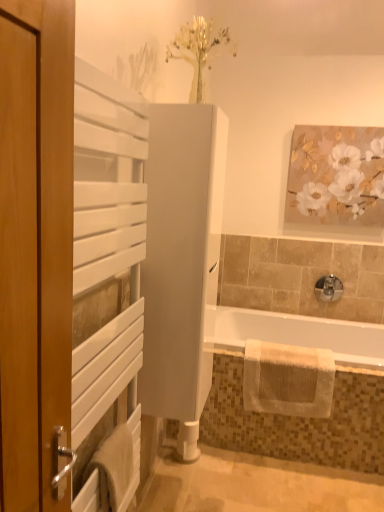
Question: Should I look upward or downward to see satin nickel faucet at lower right?

Choices:
 (A) up
 (B) down

Answer: (B)

Question: Considering the relative sizes of white textured towel at lower right, which appears as the 2th bath towel when viewed from the left, and white glossy bathtub at lower center in the image provided, is white textured towel at lower right, which appears as the 2th bath towel when viewed from the left, smaller than white glossy bathtub at lower center?

Choices:
 (A) yes
 (B) no

Answer: (B)

Question: Considering the relative sizes of white textured towel at lower right, which appears as the 2th bath towel when viewed from the left, and white glossy bathtub at lower center in the image provided, is white textured towel at lower right, which appears as the 2th bath towel when viewed from the left, taller than white glossy bathtub at lower center?

Choices:
 (A) no
 (B) yes

Answer: (B)

Question: Would you say white textured towel at lower right, which appears as the 2th bath towel when viewed from the left, contains white glossy bathtub at lower center?

Choices:
 (A) yes
 (B) no

Answer: (B)

Question: Does white textured towel at lower right, placed as the 2th bath towel when sorted from front to back, have a lesser width compared to white glossy bathtub at lower center?

Choices:
 (A) no
 (B) yes

Answer: (B)

Question: From a real-world perspective, is white textured towel at lower right, placed as the 1th bath towel when sorted from back to front, located higher than white glossy bathtub at lower center?

Choices:
 (A) yes
 (B) no

Answer: (B)

Question: Considering the relative positions of white textured towel at lower right, placed as the 1th bath towel when sorted from back to front, and white glossy bathtub at lower center in the image provided, is white textured towel at lower right, placed as the 1th bath towel when sorted from back to front, in front of white glossy bathtub at lower center?

Choices:
 (A) yes
 (B) no

Answer: (B)

Question: Is white glossy tub at lower right completely or partially inside white textured towel at lower right, placed as the 1th bath towel when sorted from back to front?

Choices:
 (A) yes
 (B) no

Answer: (B)

Question: From the image's perspective, is white textured towel at lower right, placed as the 1th bath towel when sorted from back to front, below white glossy tub at lower right?

Choices:
 (A) no
 (B) yes

Answer: (B)

Question: Does white textured towel at lower right, placed as the 1th bath towel when sorted from right to left, have a lesser width compared to white glossy tub at lower right?

Choices:
 (A) no
 (B) yes

Answer: (B)

Question: Is white textured towel at lower right, which appears as the 2th bath towel when viewed from the left, to the right of white glossy tub at lower right from the viewer's perspective?

Choices:
 (A) yes
 (B) no

Answer: (B)

Question: Is white textured towel at lower right, which appears as the 2th bath towel when viewed from the left, touching white glossy tub at lower right?

Choices:
 (A) no
 (B) yes

Answer: (A)

Question: Does white textured towel at lower right, placed as the 1th bath towel when sorted from back to front, lie in front of white glossy tub at lower right?

Choices:
 (A) no
 (B) yes

Answer: (A)

Question: From a real-world perspective, does white glossy tub at lower right stand above white matte radiator at left, the 2th screen door positioned from the back?

Choices:
 (A) no
 (B) yes

Answer: (A)